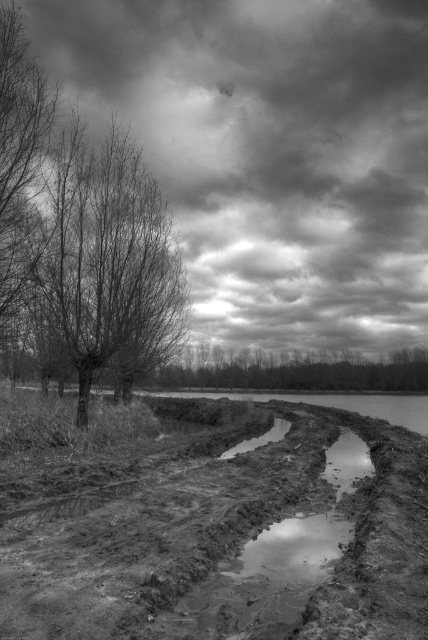
Who is more forward, [151,192] or [276,438]?

Point [151,192] is more forward.

Does smooth bark tree at left have a lesser width compared to glossy mud puddle at center?

In fact, smooth bark tree at left might be wider than glossy mud puddle at center.

At what (x,y) coordinates should I click in order to perform the action: click on smooth bark tree at left. Please return your answer as a coordinate pair (x, y). Looking at the image, I should click on (107, 266).

Does muddy/dirt at center have a larger size compared to smooth bark tree at center?

No.

In the scene shown: Who is shorter, muddy/dirt at center or smooth bark tree at center?

muddy/dirt at center

Is point (344, 602) closer to camera compared to point (312, 388)?

Yes.

This screenshot has width=428, height=640. I want to click on muddy/dirt at center, so click(219, 534).

Can you confirm if muddy/dirt at center is positioned to the right of glossy mud puddle at center?

In fact, muddy/dirt at center is to the left of glossy mud puddle at center.

Between point (83, 600) and point (258, 438), which one is positioned in front?

Point (83, 600) is in front.

Is point (305, 476) positioned after point (261, 444)?

No, it is not.

Identify the location of muddy/dirt at center. (219, 534).